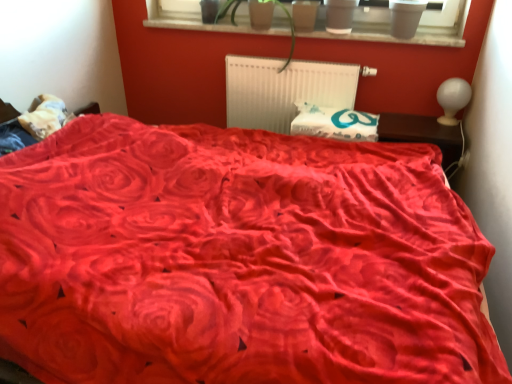
Question: Would you say matte plastic pots at upper center is a long distance from white glossy lampshade at upper right?

Choices:
 (A) no
 (B) yes

Answer: (A)

Question: Can you confirm if matte plastic pots at upper center is bigger than white glossy lampshade at upper right?

Choices:
 (A) no
 (B) yes

Answer: (B)

Question: Does matte plastic pots at upper center have a greater width compared to white glossy lampshade at upper right?

Choices:
 (A) no
 (B) yes

Answer: (A)

Question: From a real-world perspective, is matte plastic pots at upper center beneath white glossy lampshade at upper right?

Choices:
 (A) yes
 (B) no

Answer: (B)

Question: Is matte plastic pots at upper center positioned behind white glossy lampshade at upper right?

Choices:
 (A) yes
 (B) no

Answer: (A)

Question: Would you say velvet red bed at center is inside or outside smooth wood window sill at upper center?

Choices:
 (A) inside
 (B) outside

Answer: (B)

Question: Visually, is velvet red bed at center positioned to the left or to the right of smooth wood window sill at upper center?

Choices:
 (A) right
 (B) left

Answer: (B)

Question: Considering the positions of velvet red bed at center and smooth wood window sill at upper center in the image, is velvet red bed at center taller or shorter than smooth wood window sill at upper center?

Choices:
 (A) short
 (B) tall

Answer: (B)

Question: Relative to smooth wood window sill at upper center, is velvet red bed at center in front or behind?

Choices:
 (A) behind
 (B) front

Answer: (B)

Question: Considering the positions of matte gray flowerpot at upper center, marked as the 2th flowerpot in a left-to-right arrangement, and white plastic radiator at center in the image, is matte gray flowerpot at upper center, marked as the 2th flowerpot in a left-to-right arrangement, wider or thinner than white plastic radiator at center?

Choices:
 (A) thin
 (B) wide

Answer: (B)

Question: Does point (337, 23) appear closer or farther from the camera than point (301, 66)?

Choices:
 (A) closer
 (B) farther

Answer: (A)

Question: In terms of size, does matte gray flowerpot at upper center, marked as the 2th flowerpot in a left-to-right arrangement, appear bigger or smaller than white plastic radiator at center?

Choices:
 (A) small
 (B) big

Answer: (A)

Question: Is matte gray flowerpot at upper center, marked as the 2th flowerpot in a left-to-right arrangement, inside the boundaries of white plastic radiator at center, or outside?

Choices:
 (A) inside
 (B) outside

Answer: (B)

Question: From the image's perspective, is brown wooden table at right above or below velvet red bed at center?

Choices:
 (A) below
 (B) above

Answer: (B)

Question: Is brown wooden table at right in front of or behind velvet red bed at center in the image?

Choices:
 (A) behind
 (B) front

Answer: (A)